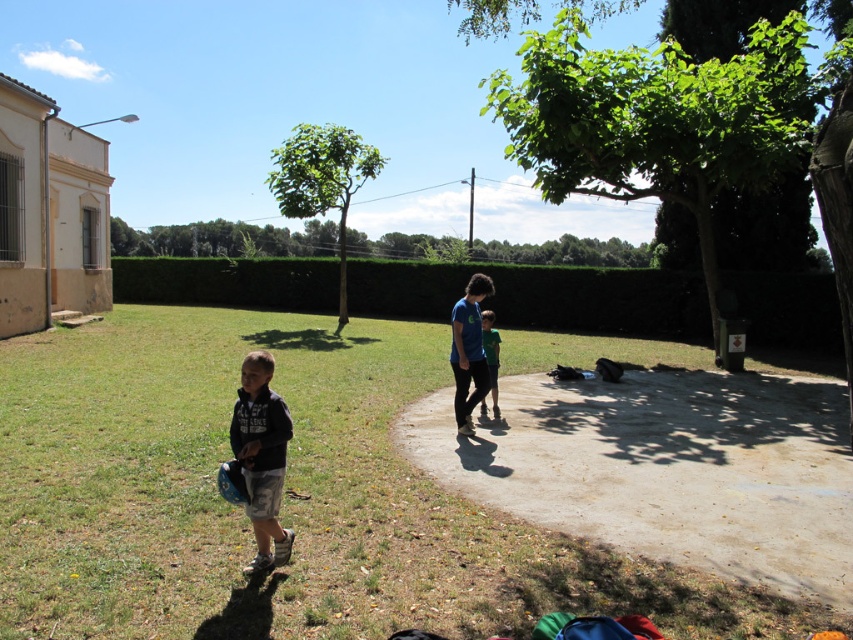
You are a photographer setting up for a group photo. You need to ensure that the green leafy hedge at center and the dark gray cotton shirt at lower left are both visible in the frame. Considering their sizes, which object should you focus on to ensure both are in the shot?

The green leafy hedge at center is larger in size than the dark gray cotton shirt at lower left. To ensure both are visible, focus on the larger object, the green leafy hedge at center, as it requires more space in the frame.

You are standing in the park and want to find the green leafy hedge at center. According to the coordinates provided, where exactly should you look?

The green leafy hedge at center is located at point 0.464 on the x axis and 0.634 on the y axis.

You are standing in the park and see the green grass at lower left and the green leafy hedge at center. Which one is closer to the ground?

The green grass at lower left is shorter than the green leafy hedge at center, so the green grass at lower left is closer to the ground.